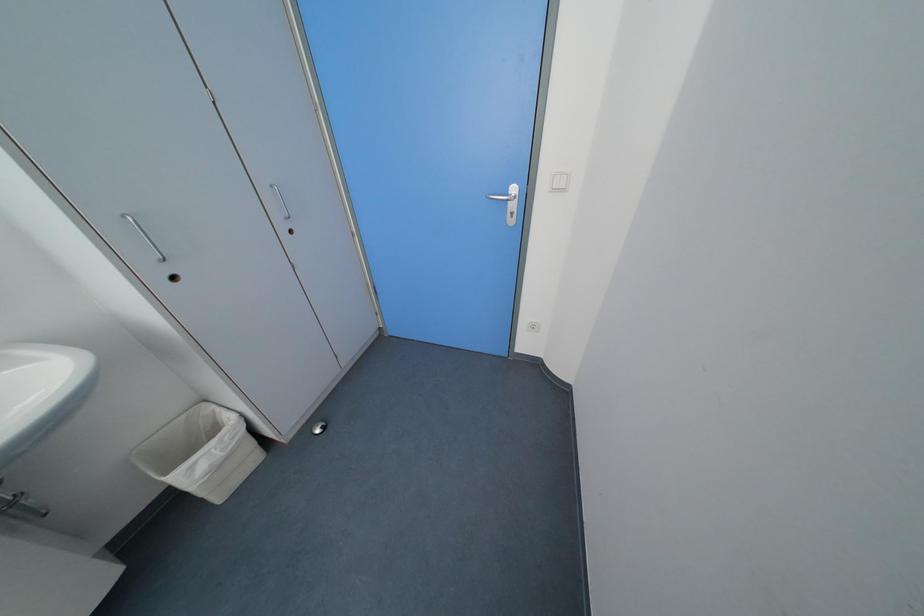
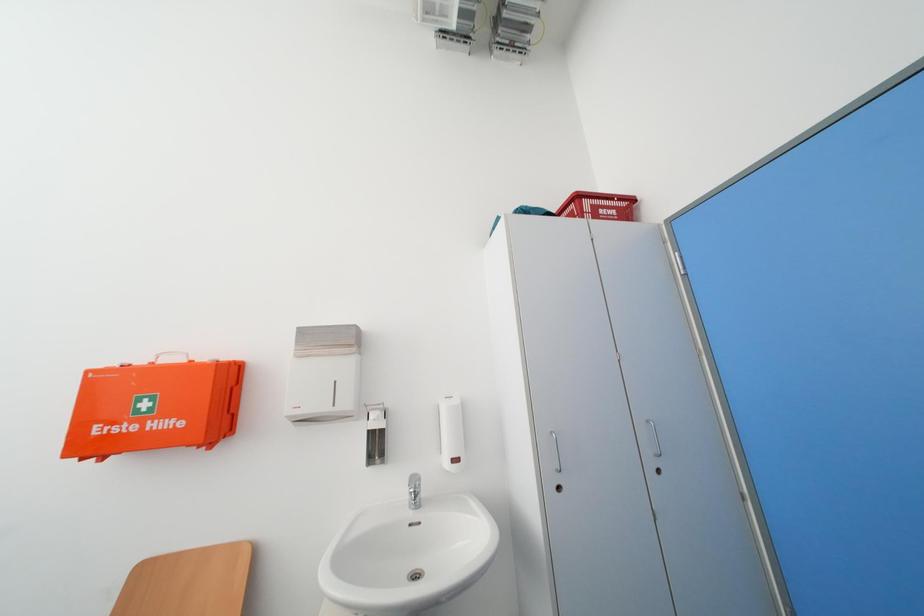
In the scene shown: The first image is from the beginning of the video and the second image is from the end. How did the camera likely rotate when shooting the video?

The camera rotated toward left-up.